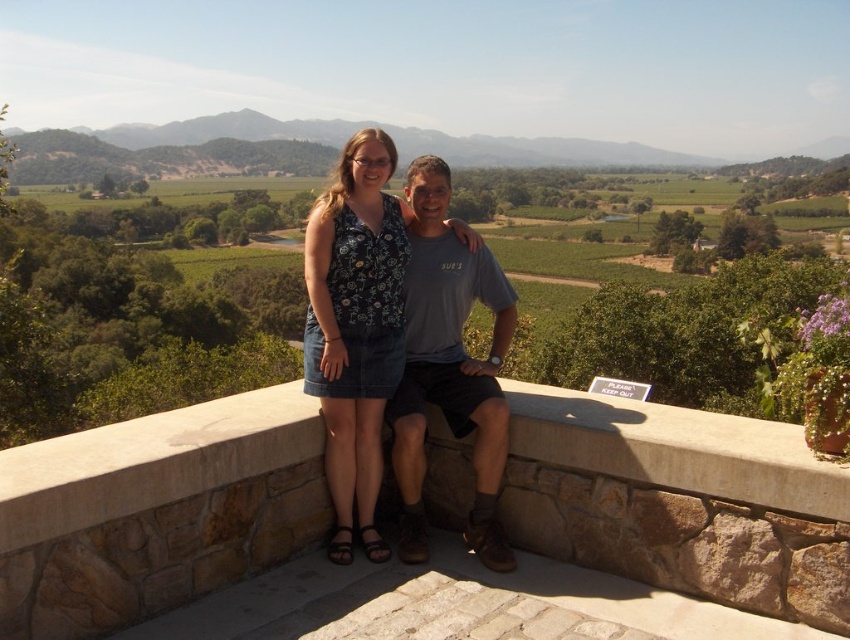
Question: Which of the following is the closest to the observer?

Choices:
 (A) (177, 490)
 (B) (421, 460)

Answer: (A)

Question: Can you confirm if stone ledge at center is smaller than gray cotton t-shirt at center?

Choices:
 (A) no
 (B) yes

Answer: (B)

Question: Among these points, which one is nearest to the camera?

Choices:
 (A) (618, 433)
 (B) (403, 536)

Answer: (A)

Question: Which object is farther from the camera taking this photo?

Choices:
 (A) gray cotton t-shirt at center
 (B) denim skirt at center

Answer: (B)

Question: Can you confirm if denim skirt at center is smaller than gray cotton t-shirt at center?

Choices:
 (A) no
 (B) yes

Answer: (A)

Question: Does stone ledge at center appear on the left side of denim skirt at center?

Choices:
 (A) yes
 (B) no

Answer: (B)